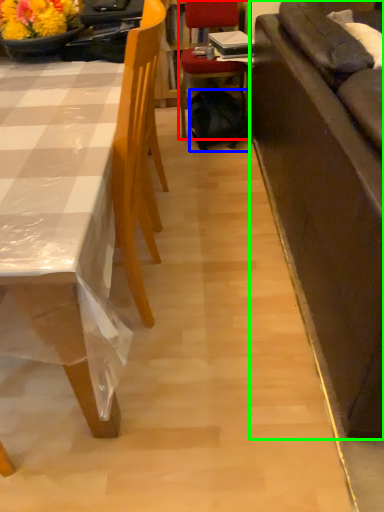
Question: Which is farther away from chair (highlighted by a red box)? backpack (highlighted by a blue box) or studio couch (highlighted by a green box)?

Choices:
 (A) backpack
 (B) studio couch

Answer: (B)